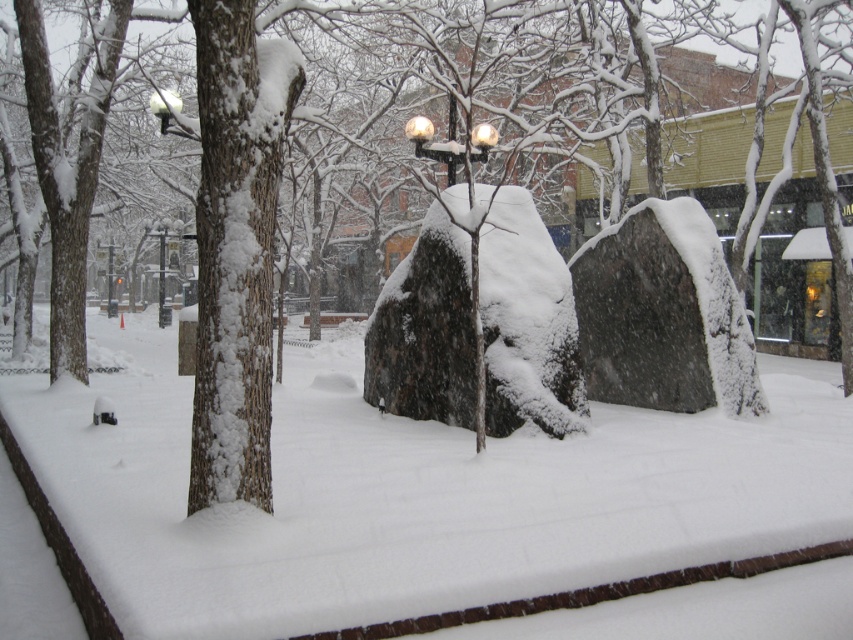
Between white fluffy snow at center and satin black lamp post at center, which one has more height?

Standing taller between the two is satin black lamp post at center.

Can you confirm if white fluffy snow at center is thinner than satin black lamp post at center?

In fact, white fluffy snow at center might be wider than satin black lamp post at center.

Locate an element on the screen. This screenshot has width=853, height=640. white fluffy snow at center is located at coordinates (413, 493).